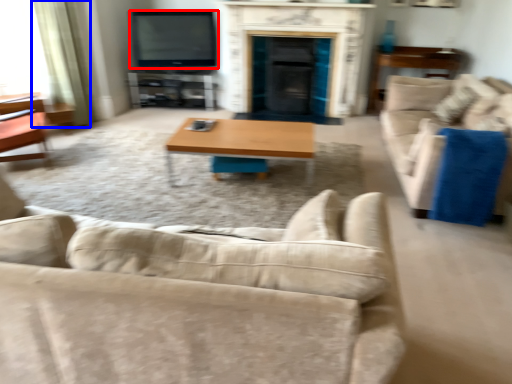
Question: Which of the following is the closest to the observer, television (highlighted by a red box) or curtain (highlighted by a blue box)?

Choices:
 (A) television
 (B) curtain

Answer: (B)